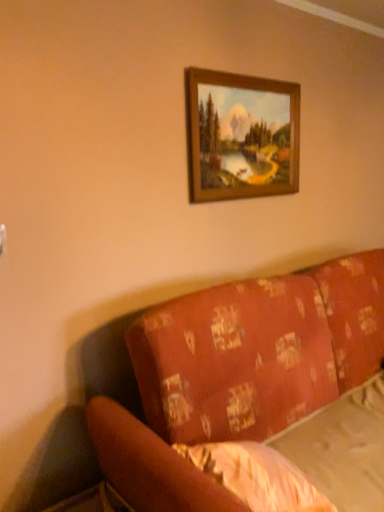
Question: Should I look upward or downward to see wooden frame at upper center?

Choices:
 (A) up
 (B) down

Answer: (A)

Question: From a real-world perspective, is patterned fabric couch at lower right located higher than wooden frame at upper center?

Choices:
 (A) no
 (B) yes

Answer: (A)

Question: Considering the relative positions of patterned fabric couch at lower right and wooden frame at upper center in the image provided, is patterned fabric couch at lower right to the left of wooden frame at upper center from the viewer's perspective?

Choices:
 (A) no
 (B) yes

Answer: (A)

Question: From a real-world perspective, is patterned fabric couch at lower right under wooden frame at upper center?

Choices:
 (A) yes
 (B) no

Answer: (A)

Question: Does patterned fabric couch at lower right have a larger size compared to wooden frame at upper center?

Choices:
 (A) no
 (B) yes

Answer: (B)

Question: Considering the relative sizes of patterned fabric couch at lower right and wooden frame at upper center in the image provided, is patterned fabric couch at lower right wider than wooden frame at upper center?

Choices:
 (A) no
 (B) yes

Answer: (B)

Question: Does patterned fabric couch at lower right have a greater height compared to wooden frame at upper center?

Choices:
 (A) yes
 (B) no

Answer: (A)

Question: Is wooden frame at upper center at the back of white textured sheet at lower right?

Choices:
 (A) no
 (B) yes

Answer: (A)

Question: Is white textured sheet at lower right outside of wooden frame at upper center?

Choices:
 (A) no
 (B) yes

Answer: (B)

Question: Does white textured sheet at lower right have a smaller size compared to wooden frame at upper center?

Choices:
 (A) yes
 (B) no

Answer: (B)

Question: Is white textured sheet at lower right wider than wooden frame at upper center?

Choices:
 (A) no
 (B) yes

Answer: (B)

Question: Is white textured sheet at lower right further to the viewer compared to wooden frame at upper center?

Choices:
 (A) yes
 (B) no

Answer: (B)

Question: Is wooden frame at upper center located within white textured sheet at lower right?

Choices:
 (A) yes
 (B) no

Answer: (B)

Question: Is wooden frame at upper center far away from patterned fabric couch at lower right?

Choices:
 (A) no
 (B) yes

Answer: (A)